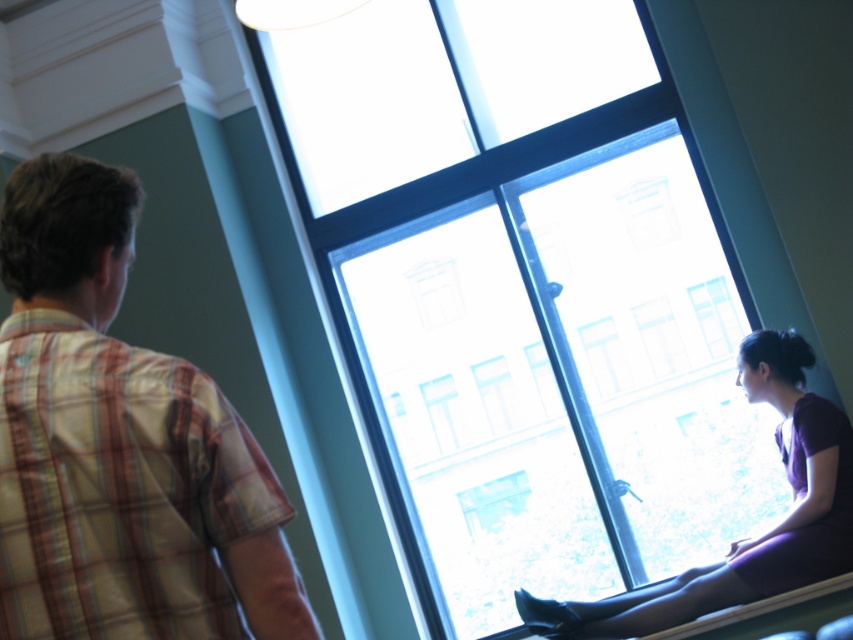
You are standing in the room and want to look at the view outside the transparent glass window at center without the matte purple dress at window blocking your view. Which object should you move closer to?

You should move closer to the transparent glass window at center because it is closer to you than the matte purple dress at window, so moving towards it would allow you to see around the dress.

You are standing in the room and want to see the view outside the transparent glass window at center without moving your position. Is the matte purple dress at window blocking your view?

The transparent glass window at center is taller than the matte purple dress at window, so the dress is shorter than the window. Therefore, the top part of the window should still be visible above the dress.

You are standing in the room and want to see the view outside through the transparent glass window at center without blocking your view with the plaid cotton shirt at left. Which object should you move closer to?

You should move closer to the transparent glass window at center because it is larger than the plaid cotton shirt at left, allowing for a clearer view without obstruction.